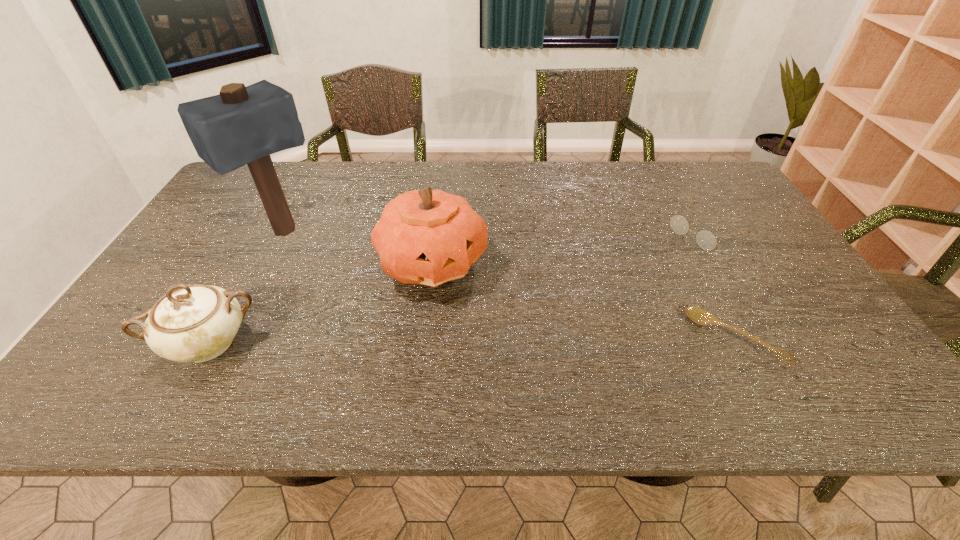
Identify which object is located as the fourth nearest to the ladle. Please provide its 2D coordinates. Your answer should be formatted as a tuple, i.e. [(x, y)], where the tuple contains the x and y coordinates of a point satisfying the conditions above.

[(195, 323)]

Where is `the closest object to the second tallest object`? This screenshot has height=540, width=960. the closest object to the second tallest object is located at coordinates (242, 125).

Find the location of a particular element. This screenshot has width=960, height=540. vacant space that satisfies the following two spatial constraints: 1. on the back side of the mallet; 2. on the right side of the second shortest object is located at coordinates (286, 231).

Locate an element on the screen. The image size is (960, 540). vacant space that satisfies the following two spatial constraints: 1. on the front side of the second tallest object; 2. on the left side of the tallest object is located at coordinates (270, 262).

The width and height of the screenshot is (960, 540). I want to click on vacant space that satisfies the following two spatial constraints: 1. on the back side of the second shortest object; 2. on the left side of the chinaware, so click(272, 231).

Locate an element on the screen. free spot that satisfies the following two spatial constraints: 1. on the front side of the shortest object; 2. on the left side of the third object from right to left is located at coordinates (424, 339).

You are a GUI agent. You are given a task and a screenshot of the screen. Output one action in this format:
    pyautogui.click(x=<x>, y=<y>)
    Task: Click on the free space in the image that satisfies the following two spatial constraints: 1. on the front side of the second tallest object; 2. on the left side of the tallest object
    The image size is (960, 540).
    Given the screenshot: What is the action you would take?
    pyautogui.click(x=270, y=262)